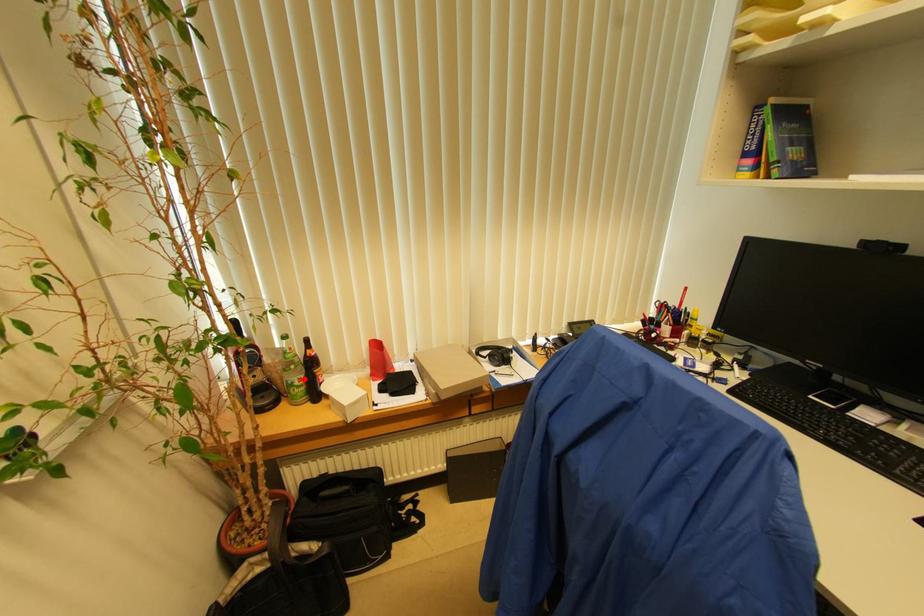
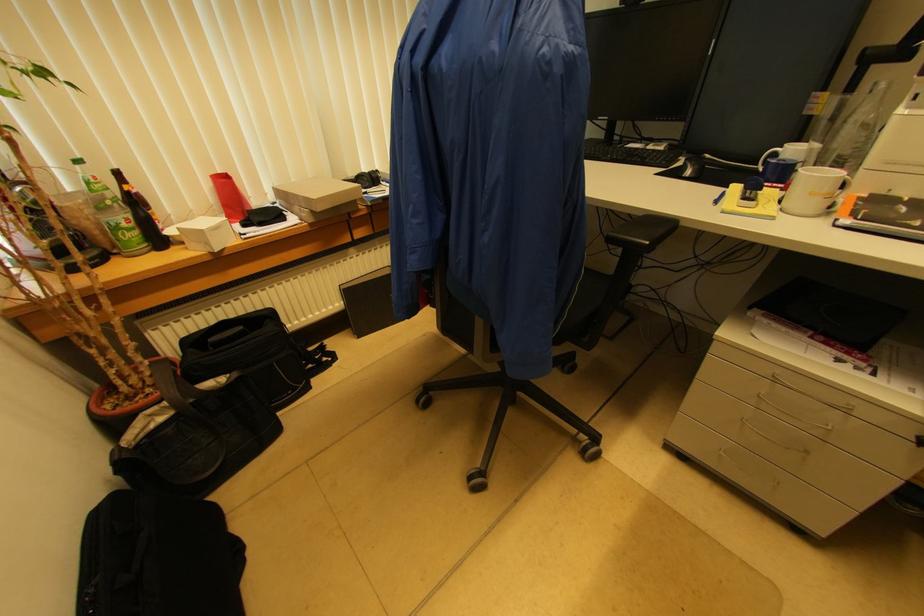
Question: A red point is marked in image1. In image2, is the corresponding 3D point closer to the camera or farther? Reply with the corresponding letter.

Choices:
 (A) The corresponding 3D point is closer.
 (B) The corresponding 3D point is farther.

Answer: (B)